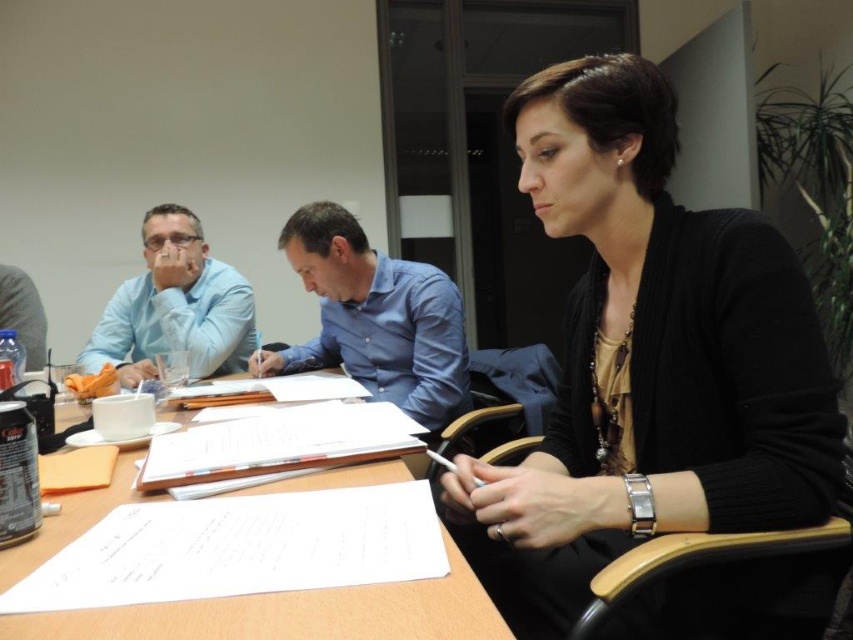
Question: Does wooden table at center have a larger size compared to matte blue shirt at left?

Choices:
 (A) yes
 (B) no

Answer: (B)

Question: Which of these objects is positioned closest to the yellow paper at lower left?

Choices:
 (A) blue shirt at center
 (B) black matte cardigan at center
 (C) wooden table at center
 (D) matte blue shirt at left

Answer: (C)

Question: Which point appears closest to the camera in this image?

Choices:
 (A) (697, 612)
 (B) (132, 304)
 (C) (107, 476)
 (D) (71, 532)

Answer: (D)

Question: Is black matte cardigan at center smaller than blue shirt at center?

Choices:
 (A) no
 (B) yes

Answer: (A)

Question: Is matte blue shirt at left smaller than yellow paper at lower left?

Choices:
 (A) no
 (B) yes

Answer: (A)

Question: Which of the following is the closest to the observer?

Choices:
 (A) blue shirt at center
 (B) wooden table at center

Answer: (B)